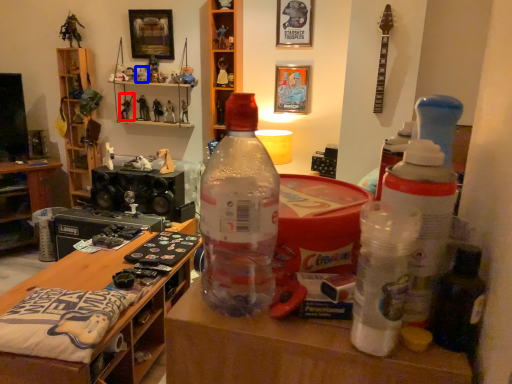
Question: Among these objects, which one is farthest to the camera, toy (highlighted by a red box) or toy (highlighted by a blue box)?

Choices:
 (A) toy
 (B) toy

Answer: (A)